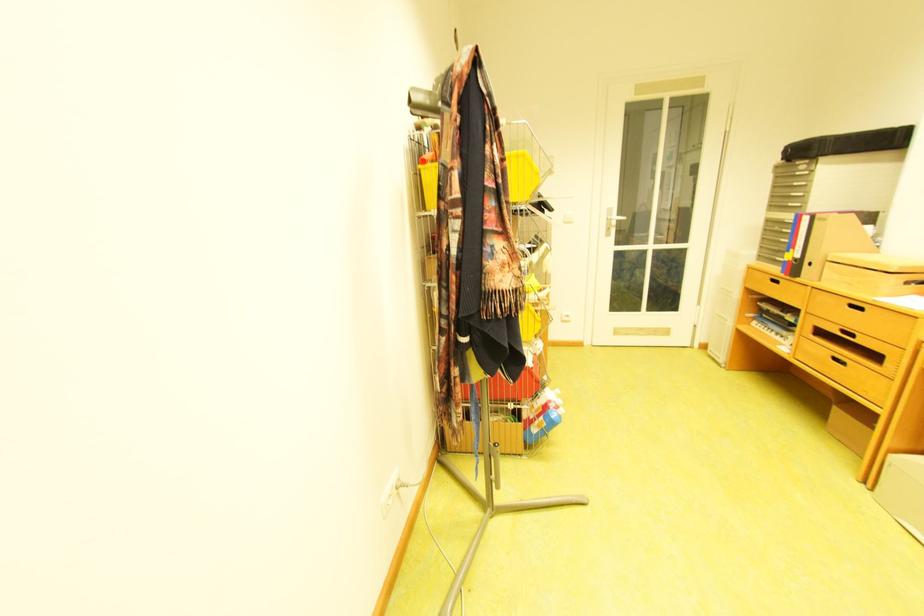
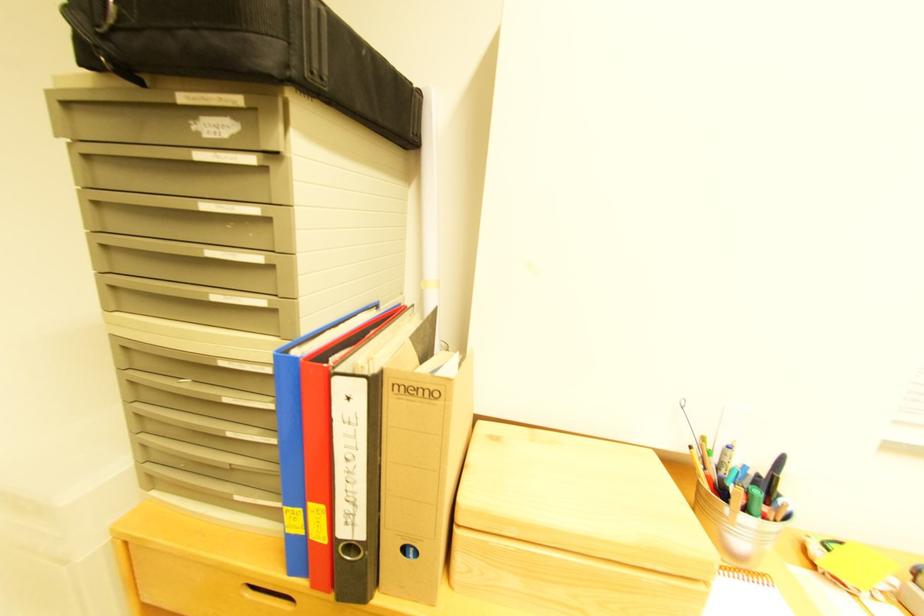
Locate, in the second image, the point that corresponds to the point at 809,257 in the first image.

(371, 536)